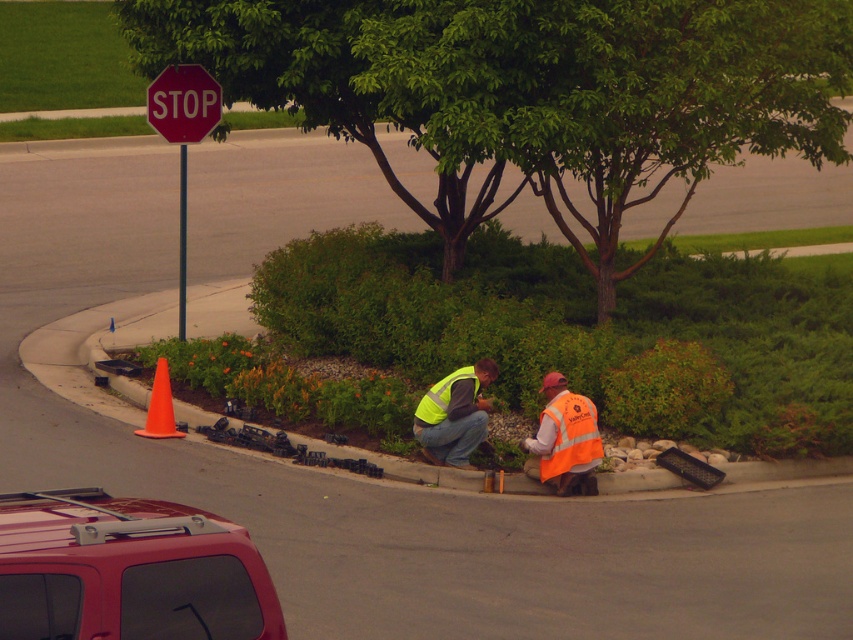
Can you confirm if high-visibility yellow vest at center is positioned above orange plastic traffic cone at lower left?

Incorrect, high-visibility yellow vest at center is not positioned above orange plastic traffic cone at lower left.

Measure the distance between point (x=448, y=387) and camera.

Point (x=448, y=387) and camera are 16.83 meters apart.

Image resolution: width=853 pixels, height=640 pixels. I want to click on high-visibility yellow vest at center, so click(454, 413).

Is high-visibility yellow vest at center positioned in front of red matte stop sign at upper left?

That is True.

Does high-visibility yellow vest at center have a greater width compared to red matte stop sign at upper left?

No.

The height and width of the screenshot is (640, 853). Describe the element at coordinates (454, 413) in the screenshot. I see `high-visibility yellow vest at center` at that location.

Where is `high-visibility yellow vest at center`? high-visibility yellow vest at center is located at coordinates (454, 413).

Can you confirm if green leafy tree at upper center is thinner than yellow reflective safety vest at center?

Yes, green leafy tree at upper center is thinner than yellow reflective safety vest at center.

Which is behind, point (194, 38) or point (427, 410)?

The point (194, 38) is more distant.

You are a GUI agent. You are given a task and a screenshot of the screen. Output one action in this format:
    pyautogui.click(x=<x>, y=<y>)
    Task: Click on the green leafy tree at upper center
    
    Given the screenshot: What is the action you would take?
    pyautogui.click(x=531, y=90)